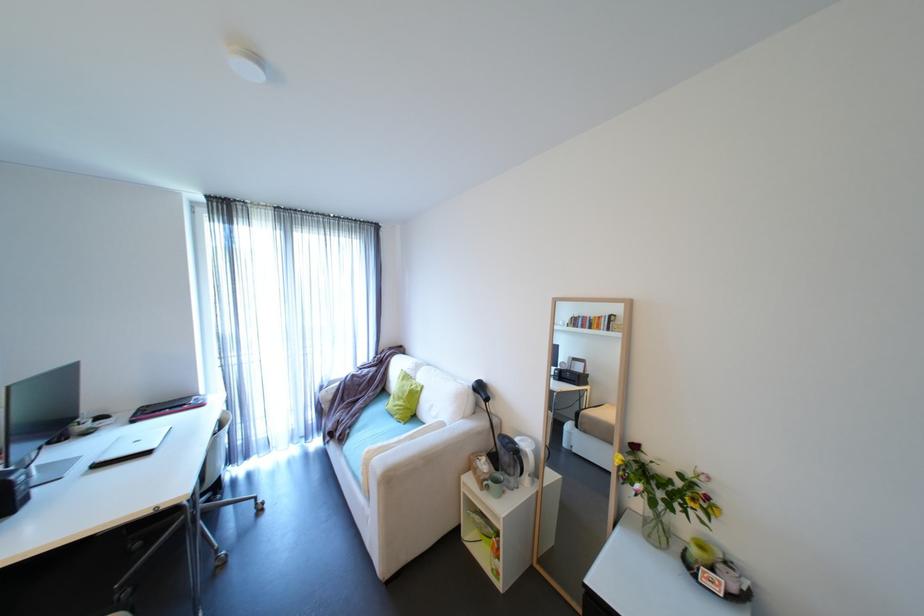
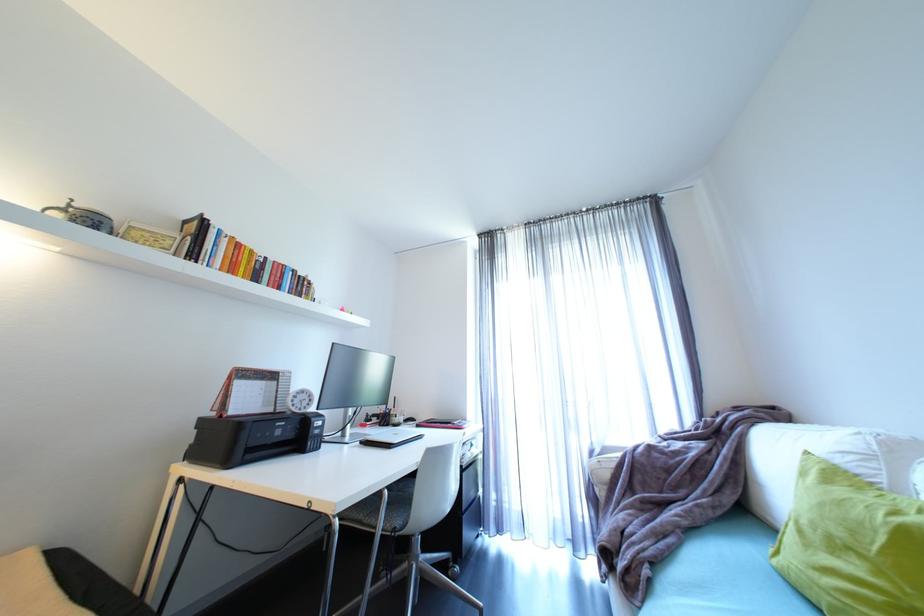
Where in the second image is the point corresponding to [355,431] from the first image?

(653, 572)